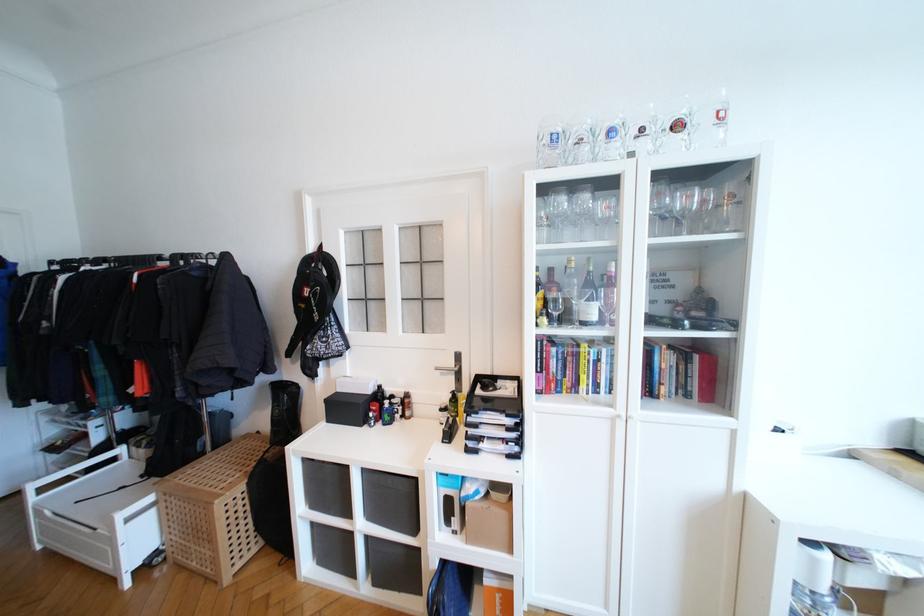
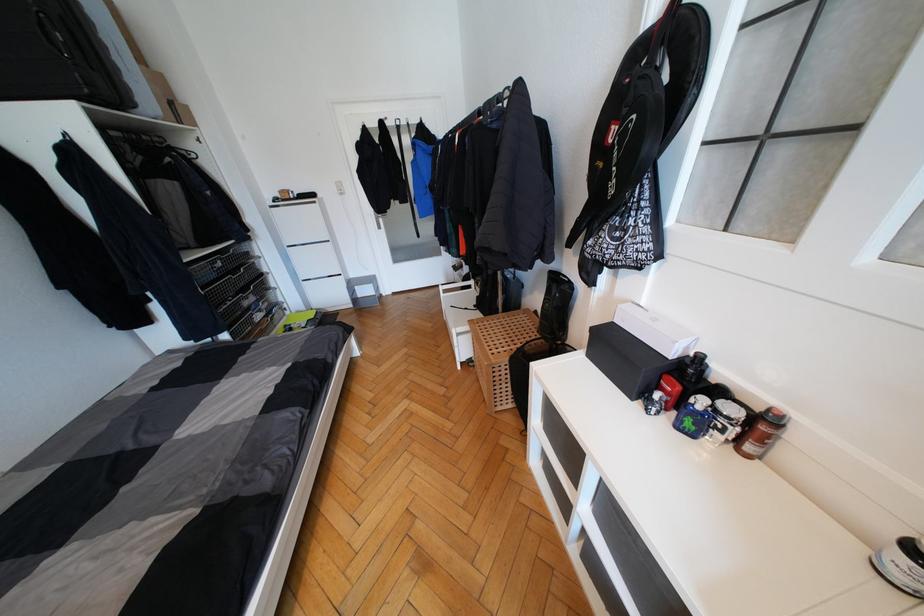
Question: I am providing you with two images of the same scene from different viewpoints. After the viewpoint changes to image2, which objects are now occluded?

Choices:
 (A) red perfume bottle
 (B) black backpack strap
 (C) recessed drawer handle
 (D) none of these

Answer: (D)